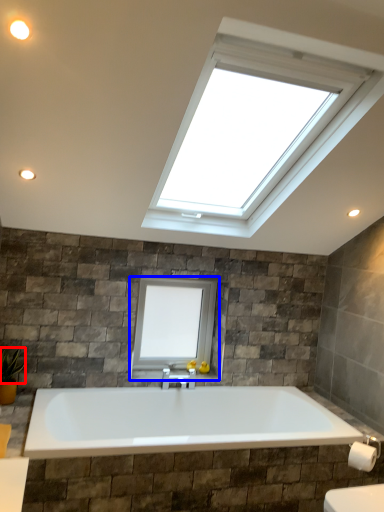
Question: Which of the following is the farthest to the observer, plant (highlighted by a red box) or window (highlighted by a blue box)?

Choices:
 (A) plant
 (B) window

Answer: (B)